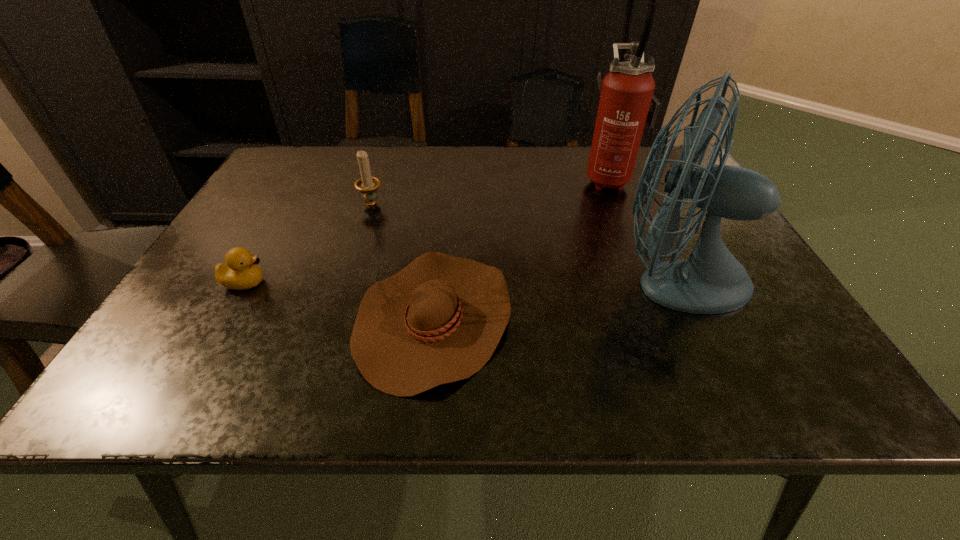
Locate an element on the screen. The height and width of the screenshot is (540, 960). object at the left edge is located at coordinates (241, 271).

You are a GUI agent. You are given a task and a screenshot of the screen. Output one action in this format:
    pyautogui.click(x=<x>, y=<y>)
    Task: Click on the object present at the right edge
    The width and height of the screenshot is (960, 540).
    Given the screenshot: What is the action you would take?
    pyautogui.click(x=711, y=281)

I want to click on vacant region at the far edge of the desktop, so click(451, 183).

The image size is (960, 540). I want to click on free space at the near edge of the desktop, so (x=333, y=364).

The width and height of the screenshot is (960, 540). In the image, there is a desktop. What are the coordinates of `vacant region at the left edge` in the screenshot? It's located at (169, 317).

This screenshot has width=960, height=540. What are the coordinates of `vacant space at the right edge` in the screenshot? It's located at (716, 321).

Find the location of `free space at the far left corner of the desktop`. free space at the far left corner of the desktop is located at coordinates [x=306, y=159].

This screenshot has height=540, width=960. In order to click on vacant space at the near left corner of the desktop in this screenshot , I will do `click(134, 369)`.

You are a GUI agent. You are given a task and a screenshot of the screen. Output one action in this format:
    pyautogui.click(x=<x>, y=<y>)
    Task: Click on the vacant space at the near right corner
    Image resolution: width=960 pixels, height=540 pixels.
    Given the screenshot: What is the action you would take?
    pyautogui.click(x=793, y=383)

You are a GUI agent. You are given a task and a screenshot of the screen. Output one action in this format:
    pyautogui.click(x=<x>, y=<y>)
    Task: Click on the vacant space that's between the shortest object and the fourth shortest object
    
    Given the screenshot: What is the action you would take?
    pyautogui.click(x=554, y=298)